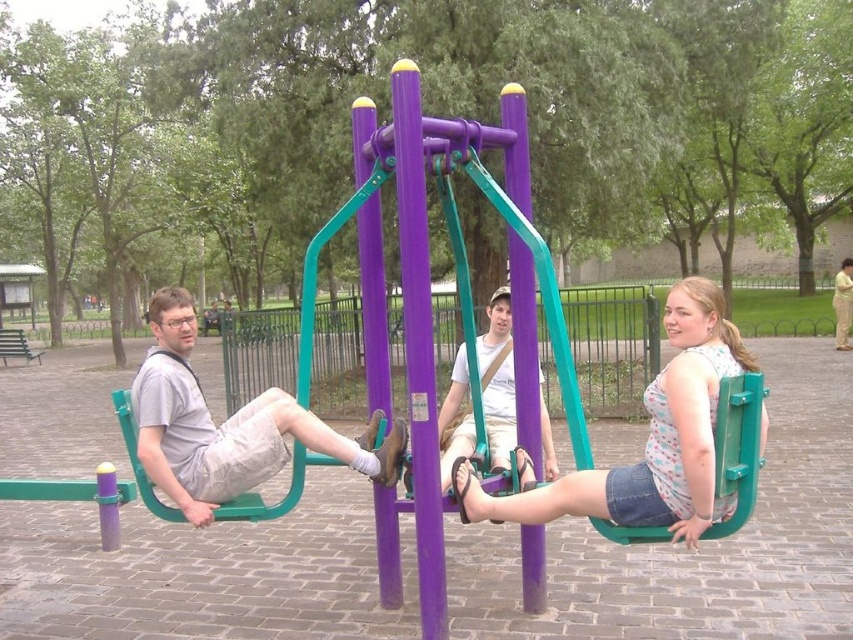
You are a park maintenance worker checking the equipment. You need to ensure that the seats can accommodate the users. Since the denim shorts at center and the matte gray shorts at left are both seated, which user has a wider seat?

The matte gray shorts at left has a wider seat than the denim shorts at center because the denim shorts at center is narrower.

You are a park maintenance worker checking the seating area. You need to determine which of the two people, the one wearing denim shorts at center or the one wearing matte gray shorts at left, has more room to move around their seat. Based on the scene description, which person has more available space?

The denim shorts at center occupies less space than matte gray shorts at left, so the person wearing denim shorts at center has more available space to move around their seat.

In the scene shown: You are a photographer trying to capture a candid shot of the two people at the park. You notice the denim shorts at center and the matte gray shorts at left. Which person should you focus on to ensure they are fully visible in your photo without cropping the top of their shorts?

The denim shorts at center has a lesser height compared to matte gray shorts at left, so focusing on the matte gray shorts at left would ensure they are fully visible without cropping the top since they are taller.